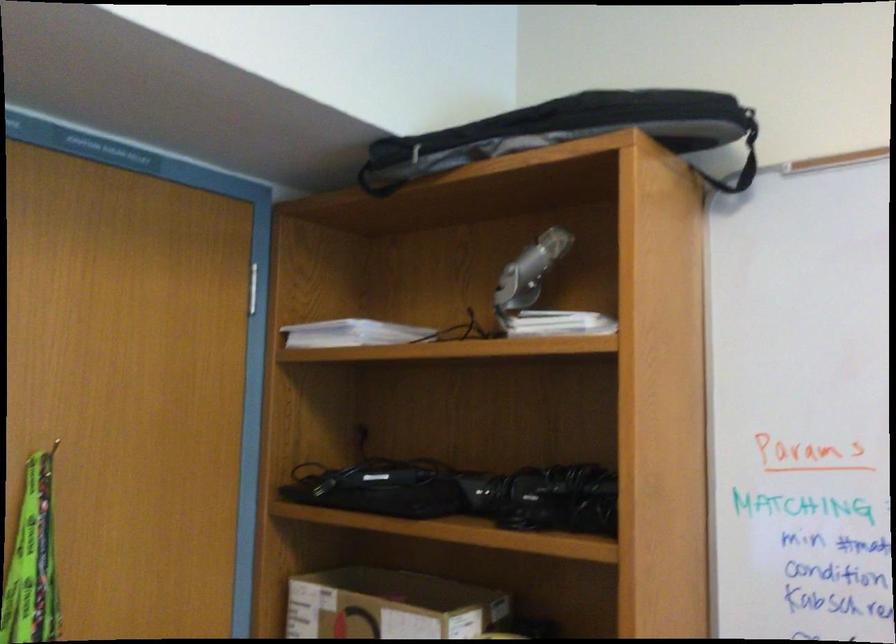
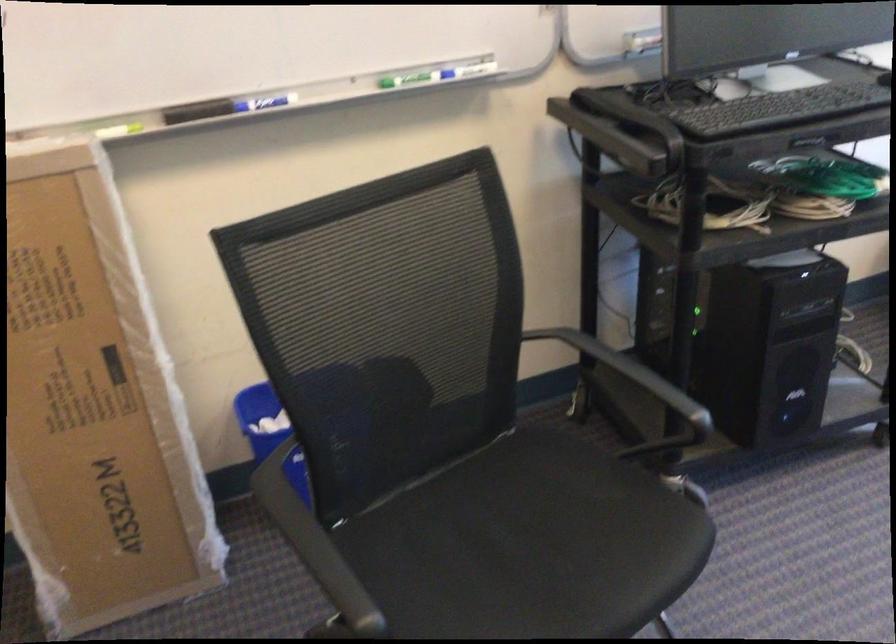
The first image is from the beginning of the video and the second image is from the end. How did the camera likely rotate when shooting the video?

The rotation direction of the camera is right-down.